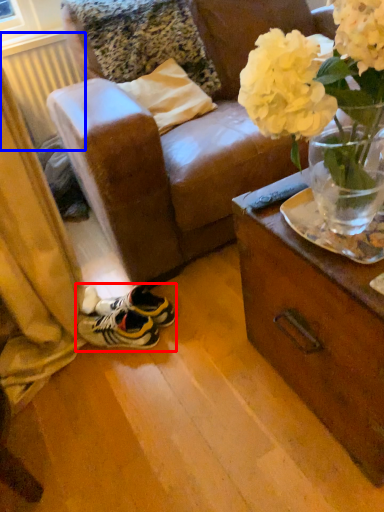
Question: Among these objects, which one is farthest to the camera, footwear (highlighted by a red box) or radiator (highlighted by a blue box)?

Choices:
 (A) footwear
 (B) radiator

Answer: (B)